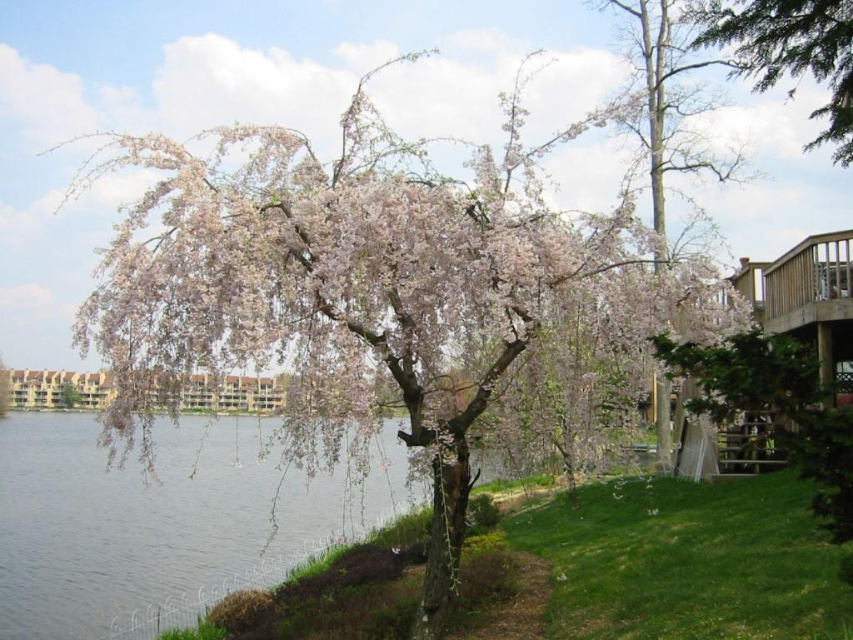
Question: Which point is closer to the camera?

Choices:
 (A) clear water at lower left
 (B) green textured tree at upper right

Answer: (A)

Question: From the image, what is the correct spatial relationship of clear water at lower left in relation to green textured tree at upper right?

Choices:
 (A) below
 (B) above

Answer: (A)

Question: Which object is farther from the camera taking this photo?

Choices:
 (A) green textured tree at upper right
 (B) clear water at lower left

Answer: (A)

Question: Is clear water at lower left smaller than green textured tree at upper right?

Choices:
 (A) no
 (B) yes

Answer: (A)

Question: In this image, where is clear water at lower left located relative to green textured tree at upper right?

Choices:
 (A) right
 (B) left

Answer: (B)

Question: Which of the following is the closest to the observer?

Choices:
 (A) (838, 29)
 (B) (253, 474)

Answer: (A)